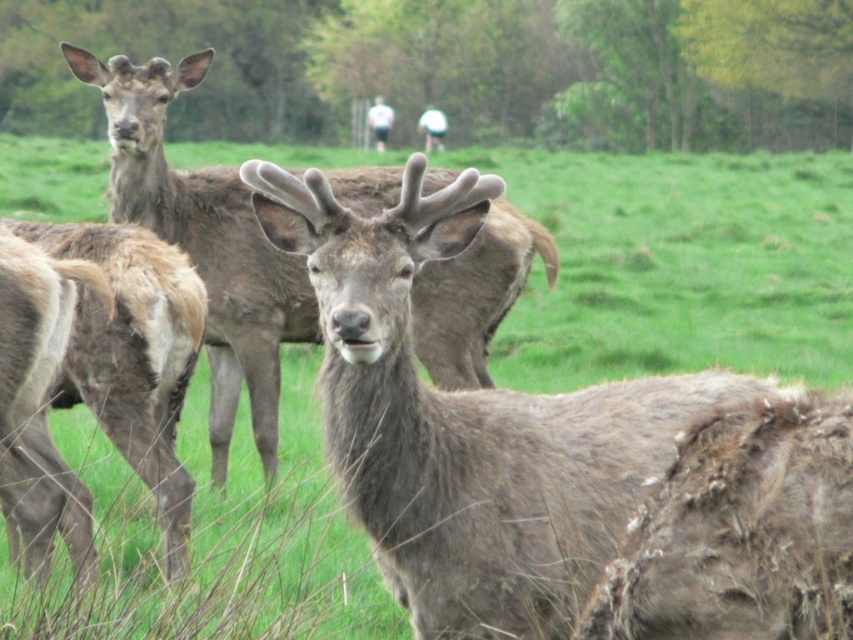
Question: In this image, where is gray fur deer at center located relative to brown fuzzy deer at center?

Choices:
 (A) right
 (B) left

Answer: (A)

Question: Which of these objects is positioned farthest from the brown fuzzy deer at center?

Choices:
 (A) gray fur deer at center
 (B) brown fur antlered deer at center

Answer: (B)

Question: Does brown fur antlered deer at center appear under gray fur deer at center?

Choices:
 (A) no
 (B) yes

Answer: (B)

Question: Which point is farther to the camera?

Choices:
 (A) (106, 404)
 (B) (541, 499)

Answer: (A)

Question: Is brown fur antlered deer at center closer to camera compared to brown fuzzy deer at center?

Choices:
 (A) yes
 (B) no

Answer: (A)

Question: Which object appears closest to the camera in this image?

Choices:
 (A) brown fuzzy deer at center
 (B) gray fur deer at center

Answer: (A)